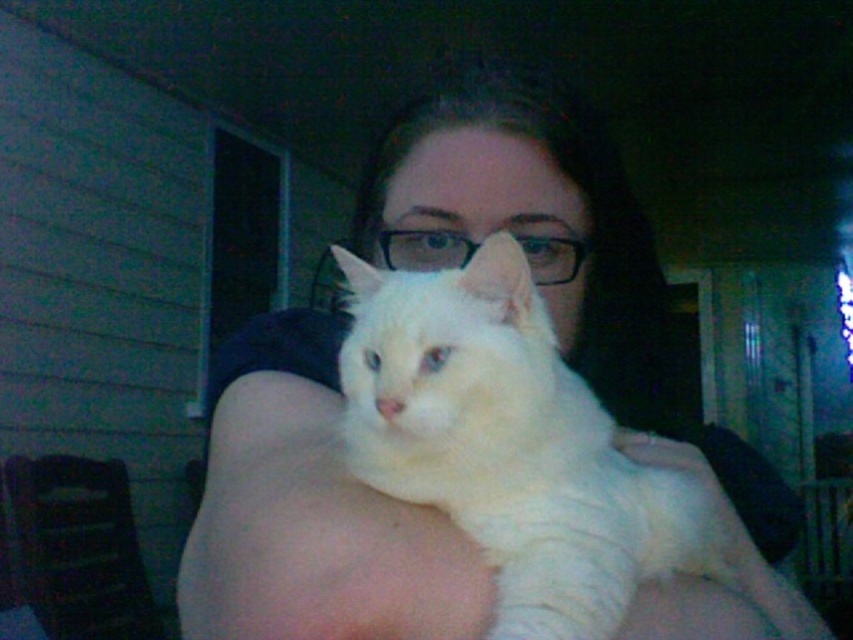
Question: Is the position of white fluffy cat at center less distant than that of white fur at upper center?

Choices:
 (A) yes
 (B) no

Answer: (A)

Question: Which object is positioned farthest from the white fur at upper center?

Choices:
 (A) white fluffy cat at center
 (B) white soft hand at center
 (C) white fur cat at center

Answer: (C)

Question: Which object is the farthest from the white fluffy cat at center?

Choices:
 (A) white fur at upper center
 (B) white fur cat at center
 (C) white soft hand at center

Answer: (C)

Question: Does white fluffy cat at center have a smaller size compared to white fur at upper center?

Choices:
 (A) yes
 (B) no

Answer: (B)

Question: Among these points, which one is farthest from the camera?

Choices:
 (A) (347, 349)
 (B) (303, 504)
 (C) (724, 518)

Answer: (C)

Question: Does white fur cat at center appear on the left side of white fluffy cat at center?

Choices:
 (A) yes
 (B) no

Answer: (B)